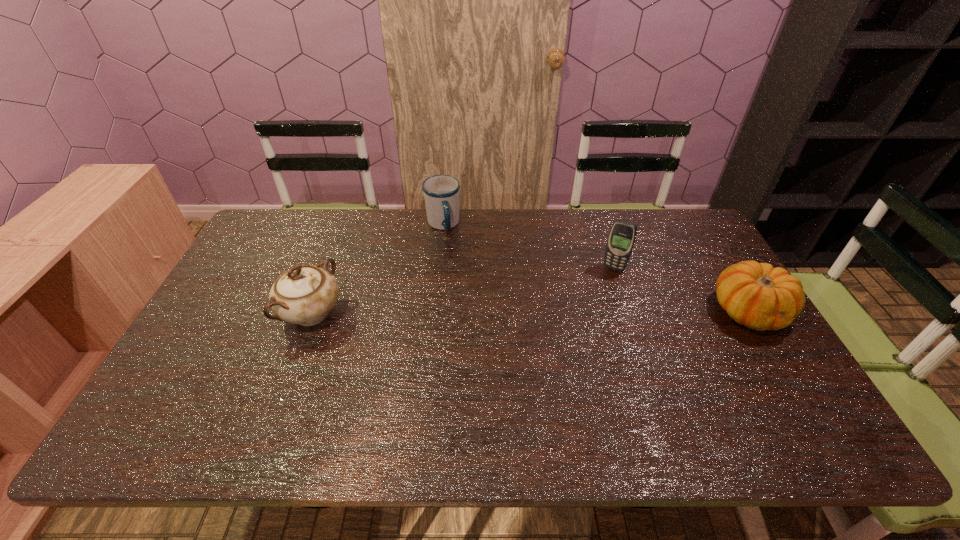
Where is `vacant area that lies between the mug and the leftmost object`? The image size is (960, 540). vacant area that lies between the mug and the leftmost object is located at coordinates (377, 269).

The image size is (960, 540). I want to click on unoccupied area between the second object from right to left and the mug, so click(x=529, y=247).

What are the coordinates of `vacant space that is in between the leftmost object and the gourd` in the screenshot? It's located at (531, 312).

Where is `unoccupied position between the chinaware and the rightmost object`? unoccupied position between the chinaware and the rightmost object is located at coordinates (531, 312).

At what (x,y) coordinates should I click in order to perform the action: click on free space between the gourd and the farthest object. Please return your answer as a coordinate pair (x, y). The width and height of the screenshot is (960, 540). Looking at the image, I should click on tap(596, 268).

Identify the location of free spot between the leftmost object and the gourd. This screenshot has width=960, height=540. (531, 312).

Locate an element on the screen. The width and height of the screenshot is (960, 540). free area in between the rightmost object and the cellular telephone is located at coordinates (682, 290).

Where is `vacant point located between the second farthest object and the gourd`? Image resolution: width=960 pixels, height=540 pixels. vacant point located between the second farthest object and the gourd is located at coordinates (682, 290).

Identify the location of free space between the chinaware and the second farthest object. This screenshot has width=960, height=540. (463, 291).

Where is `vacant area between the rightmost object and the chinaware`? The height and width of the screenshot is (540, 960). vacant area between the rightmost object and the chinaware is located at coordinates (531, 312).